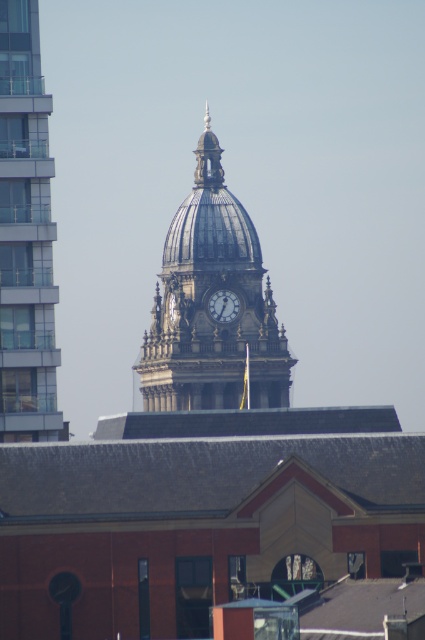
Question: Can you confirm if shiny metallic clock tower at center is positioned to the left of glassy steel clock tower at upper center?

Choices:
 (A) yes
 (B) no

Answer: (B)

Question: Among these points, which one is nearest to the camera?

Choices:
 (A) (198, 230)
 (B) (237, 298)
 (C) (31, 355)

Answer: (C)

Question: Estimate the real-world distances between objects in this image. Which object is closer to the shiny metallic clock tower at center?

Choices:
 (A) matte white clock at center
 (B) glassy steel clock tower at upper center

Answer: (A)

Question: Among these objects, which one is farthest from the camera?

Choices:
 (A) glassy steel clock tower at upper center
 (B) shiny metallic clock tower at center

Answer: (B)

Question: Can you confirm if shiny metallic clock tower at center is smaller than matte white clock at center?

Choices:
 (A) no
 (B) yes

Answer: (A)

Question: Does shiny metallic clock tower at center come in front of matte white clock at center?

Choices:
 (A) no
 (B) yes

Answer: (B)